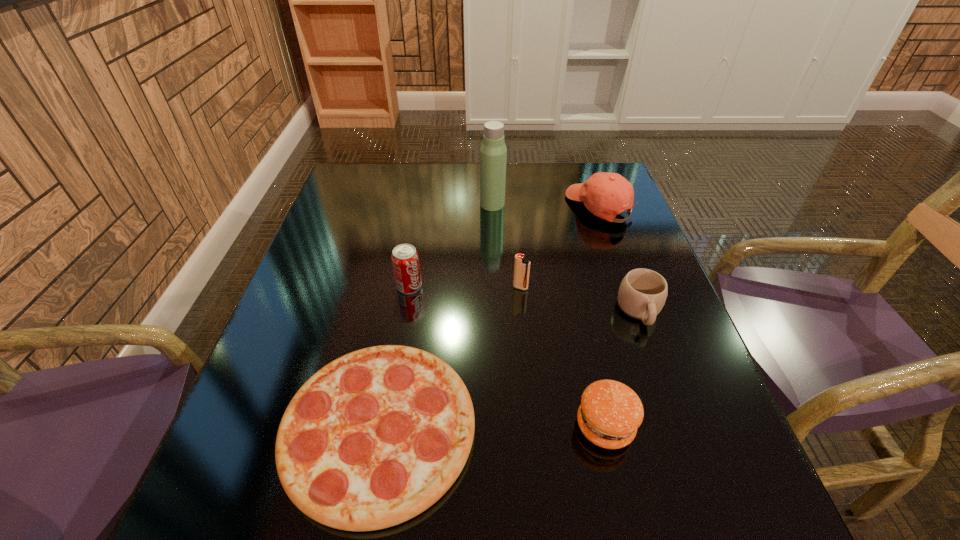
In order to click on thermos bottle in this screenshot , I will do `click(493, 153)`.

This screenshot has width=960, height=540. Identify the location of the third object from left to right. (493, 153).

Identify the location of baseball cap. (604, 194).

This screenshot has width=960, height=540. Identify the location of soda can. (405, 260).

Locate an element on the screen. The height and width of the screenshot is (540, 960). the fourth object from right to left is located at coordinates (521, 265).

The image size is (960, 540). Find the location of `patty`. patty is located at coordinates (610, 412).

The image size is (960, 540). I want to click on mug, so click(642, 293).

What are the coordinates of `pizza` in the screenshot? It's located at (374, 438).

Where is `vacant space located 0.370m on the left of the tallest object`? This screenshot has width=960, height=540. vacant space located 0.370m on the left of the tallest object is located at coordinates coord(351,204).

The image size is (960, 540). In order to click on vacant space situated on the front of the baseball cap in this screenshot , I will do `click(613, 246)`.